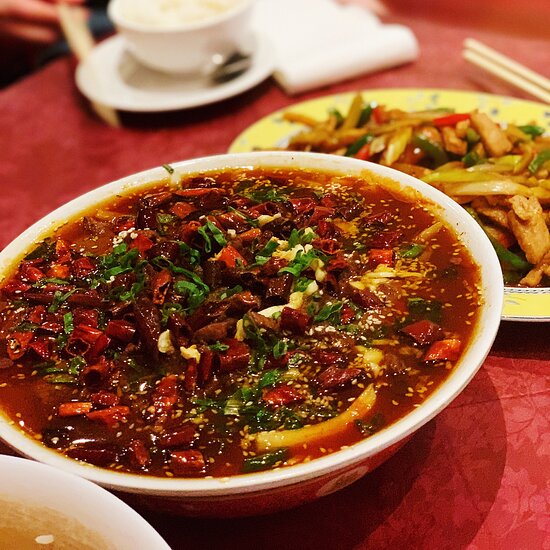
This screenshot has width=550, height=550. Find the location of `chopsticks`. chopsticks is located at coordinates (497, 73), (520, 70).